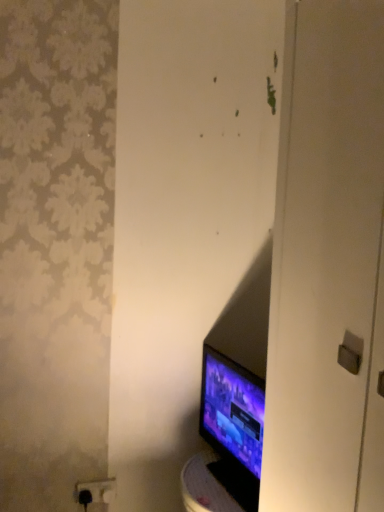
Question: Choose the correct answer: Is matte black monitor at lower right inside black plastic outlet at lower left or outside it?

Choices:
 (A) inside
 (B) outside

Answer: (B)

Question: Based on their positions, is matte black monitor at lower right located to the left or right of black plastic outlet at lower left?

Choices:
 (A) left
 (B) right

Answer: (B)

Question: From a real-world perspective, is matte black monitor at lower right above or below black plastic outlet at lower left?

Choices:
 (A) below
 (B) above

Answer: (B)

Question: Is black plastic outlet at lower left taller or shorter than matte black monitor at lower right?

Choices:
 (A) short
 (B) tall

Answer: (A)

Question: From the image's perspective, relative to matte black monitor at lower right, is black plastic outlet at lower left above or below?

Choices:
 (A) above
 (B) below

Answer: (B)

Question: Looking at their shapes, would you say black plastic outlet at lower left is wider or thinner than matte black monitor at lower right?

Choices:
 (A) wide
 (B) thin

Answer: (B)

Question: From a real-world perspective, is black plastic outlet at lower left positioned above or below matte black monitor at lower right?

Choices:
 (A) above
 (B) below

Answer: (B)